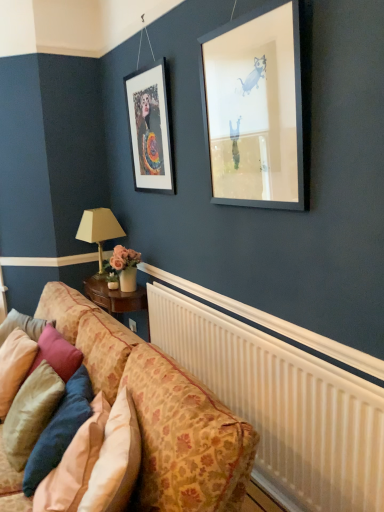
Image resolution: width=384 pixels, height=512 pixels. In order to click on white plastic radiator at lower right in this screenshot , I will do `click(282, 404)`.

This screenshot has width=384, height=512. Describe the element at coordinates (60, 430) in the screenshot. I see `velvety blue pillow at lower left, arranged as the third pillow when viewed from the left` at that location.

The width and height of the screenshot is (384, 512). I want to click on patterned fabric couch at lower left, so click(x=160, y=411).

This screenshot has width=384, height=512. What are the coordinates of `velvet pink pillow at lower left, the 2th pillow when ordered from left to right` in the screenshot? It's located at (31, 413).

Which is more to the right, velvet beige pillow at lower left, which is counted as the first pillow, starting from the left, or beige fabric lampshade at lower left?

beige fabric lampshade at lower left is more to the right.

Measure the distance between velvet beige pillow at lower left, which is counted as the first pillow, starting from the left, and beige fabric lampshade at lower left.

A distance of 1.24 meters exists between velvet beige pillow at lower left, which is counted as the first pillow, starting from the left, and beige fabric lampshade at lower left.

Is velvet beige pillow at lower left, the third pillow when ordered from right to left, shorter than beige fabric lampshade at lower left?

Incorrect, the height of velvet beige pillow at lower left, the third pillow when ordered from right to left, does not fall short of that of beige fabric lampshade at lower left.

Which object is further away from the camera, velvet beige pillow at lower left, the third pillow when ordered from right to left, or beige fabric lampshade at lower left?

beige fabric lampshade at lower left is more distant.

From the image's perspective, which is below, beige fabric lampshade at lower left or velvet pink pillow at lower left, the 2th pillow when ordered from left to right?

velvet pink pillow at lower left, the 2th pillow when ordered from left to right, is shown below in the image.

From a real-world perspective, who is located lower, beige fabric lampshade at lower left or velvet pink pillow at lower left, marked as the 2th pillow in a right-to-left arrangement?

velvet pink pillow at lower left, marked as the 2th pillow in a right-to-left arrangement, from a real-world perspective.

Could you tell me if beige fabric lampshade at lower left is turned towards velvet pink pillow at lower left, the 2th pillow when ordered from left to right?

No, beige fabric lampshade at lower left is not aimed at velvet pink pillow at lower left, the 2th pillow when ordered from left to right.

Can you confirm if beige fabric lampshade at lower left is bigger than velvet pink pillow at lower left, marked as the 2th pillow in a right-to-left arrangement?

Yes, beige fabric lampshade at lower left is bigger than velvet pink pillow at lower left, marked as the 2th pillow in a right-to-left arrangement.

Which is correct: matte black frame at upper left is inside velvet pink pillow at lower left, the 2th pillow when ordered from left to right, or outside of it?

matte black frame at upper left is spatially situated outside velvet pink pillow at lower left, the 2th pillow when ordered from left to right.

Is matte black frame at upper left placed right next to velvet pink pillow at lower left, the 2th pillow when ordered from left to right?

No, matte black frame at upper left is not touching velvet pink pillow at lower left, the 2th pillow when ordered from left to right.

From the image's perspective, is matte black frame at upper left above or below velvet pink pillow at lower left, marked as the 2th pillow in a right-to-left arrangement?

Clearly, from the image's perspective, matte black frame at upper left is above velvet pink pillow at lower left, marked as the 2th pillow in a right-to-left arrangement.

From the picture: How many degrees apart are the facing directions of matte black frame at upper left and velvet pink pillow at lower left, the 2th pillow when ordered from left to right?

They differ by 0.567 degrees in their facing directions.

From a real-world perspective, is velvety blue pillow at lower left, which ranks as the first pillow in right-to-left order, on top of white plastic radiator at lower right?

Indeed, from a real-world perspective, velvety blue pillow at lower left, which ranks as the first pillow in right-to-left order, stands above white plastic radiator at lower right.

From the image's perspective, would you say velvety blue pillow at lower left, arranged as the third pillow when viewed from the left, is shown under white plastic radiator at lower right?

Correct, velvety blue pillow at lower left, arranged as the third pillow when viewed from the left, appears lower than white plastic radiator at lower right in the image.

From the picture: Which is farther, (59, 448) or (218, 366)?

The point (218, 366) is more distant.

I want to click on the 1st pillow counting from the left of the white plastic radiator at lower right, so click(x=60, y=430).

Which object is wider, velvet beige pillow at lower left, which is counted as the first pillow, starting from the left, or patterned fabric couch at lower left?

patterned fabric couch at lower left.

Is velvet beige pillow at lower left, the third pillow when ordered from right to left, in contact with patterned fabric couch at lower left?

velvet beige pillow at lower left, the third pillow when ordered from right to left, and patterned fabric couch at lower left are not in contact.

From the image's perspective, between velvet beige pillow at lower left, which is counted as the first pillow, starting from the left, and patterned fabric couch at lower left, which one is located above?

velvet beige pillow at lower left, which is counted as the first pillow, starting from the left, appears higher in the image.

Is patterned fabric couch at lower left in contact with matte black frame at upper left?

They are not placed beside each other.

Is patterned fabric couch at lower left shorter than matte black frame at upper left?

Yes.

Which is more to the left, patterned fabric couch at lower left or matte black frame at upper left?

Positioned to the left is patterned fabric couch at lower left.

How many degrees apart are the facing directions of patterned fabric couch at lower left and matte black frame at upper left?

The facing directions of patterned fabric couch at lower left and matte black frame at upper left are 0.567 degrees apart.

Between velvet beige pillow at lower left, which is counted as the first pillow, starting from the left, and velvety blue pillow at lower left, which ranks as the first pillow in right-to-left order, which one appears on the right side from the viewer's perspective?

From the viewer's perspective, velvety blue pillow at lower left, which ranks as the first pillow in right-to-left order, appears more on the right side.

Does velvet beige pillow at lower left, which is counted as the first pillow, starting from the left, lie in front of velvety blue pillow at lower left, which ranks as the first pillow in right-to-left order?

No, velvet beige pillow at lower left, which is counted as the first pillow, starting from the left, is further to the viewer.

From the image's perspective, is velvet beige pillow at lower left, which is counted as the first pillow, starting from the left, below velvety blue pillow at lower left, which ranks as the first pillow in right-to-left order?

Actually, velvet beige pillow at lower left, which is counted as the first pillow, starting from the left, appears above velvety blue pillow at lower left, which ranks as the first pillow in right-to-left order, in the image.

Is velvet beige pillow at lower left, which is counted as the first pillow, starting from the left, outside of velvety blue pillow at lower left, which ranks as the first pillow in right-to-left order?

Indeed, velvet beige pillow at lower left, which is counted as the first pillow, starting from the left, is completely outside velvety blue pillow at lower left, which ranks as the first pillow in right-to-left order.

Locate an element on the screen. The height and width of the screenshot is (512, 384). table lamp that is behind the velvet beige pillow at lower left, which is counted as the first pillow, starting from the left is located at coordinates (99, 229).

Starting from the beige fabric lampshade at lower left, which pillow is the 2nd one in front? Please provide its 2D coordinates.

[(31, 413)]

Considering their positions, is velvet beige pillow at lower left, the third pillow when ordered from right to left, positioned closer to velvet pink pillow at lower left, the 2th pillow when ordered from left to right, than white plastic radiator at lower right?

velvet beige pillow at lower left, the third pillow when ordered from right to left.

Considering their positions, is white plastic radiator at lower right positioned further to matte black frame at upper left than patterned fabric couch at lower left?

white plastic radiator at lower right is further to matte black frame at upper left.

Considering their positions, is velvet pink pillow at lower left, marked as the 2th pillow in a right-to-left arrangement, positioned further to matte black frame at upper left than patterned fabric couch at lower left?

velvet pink pillow at lower left, marked as the 2th pillow in a right-to-left arrangement.

When comparing their distances from velvety blue pillow at lower left, which ranks as the first pillow in right-to-left order, does patterned fabric couch at lower left or velvet pink pillow at lower left, the 2th pillow when ordered from left to right, seem further?

patterned fabric couch at lower left lies further to velvety blue pillow at lower left, which ranks as the first pillow in right-to-left order, than the other object.

Looking at the image, which one is located further to velvety blue pillow at lower left, arranged as the third pillow when viewed from the left, matte black frame at upper left or beige fabric lampshade at lower left?

The object further to velvety blue pillow at lower left, arranged as the third pillow when viewed from the left, is beige fabric lampshade at lower left.

Estimate the real-world distances between objects in this image. Which object is further from velvety blue pillow at lower left, which ranks as the first pillow in right-to-left order, beige fabric lampshade at lower left or velvet pink pillow at lower left, marked as the 2th pillow in a right-to-left arrangement?

Among the two, beige fabric lampshade at lower left is located further to velvety blue pillow at lower left, which ranks as the first pillow in right-to-left order.

When comparing their distances from patterned fabric couch at lower left, does white plastic radiator at lower right or beige fabric lampshade at lower left seem closer?

white plastic radiator at lower right is positioned closer to the anchor patterned fabric couch at lower left.

When comparing their distances from velvet pink pillow at lower left, marked as the 2th pillow in a right-to-left arrangement, does velvet beige pillow at lower left, which is counted as the first pillow, starting from the left, or matte black frame at upper left seem closer?

Based on the image, velvet beige pillow at lower left, which is counted as the first pillow, starting from the left, appears to be nearer to velvet pink pillow at lower left, marked as the 2th pillow in a right-to-left arrangement.

You are a GUI agent. You are given a task and a screenshot of the screen. Output one action in this format:
    pyautogui.click(x=<x>, y=<y>)
    Task: Click on the pillow between velvety blue pillow at lower left, arranged as the third pillow when viewed from the left, and velvet beige pillow at lower left, the third pillow when ordered from right to left, along the z-axis
    The width and height of the screenshot is (384, 512).
    Given the screenshot: What is the action you would take?
    pyautogui.click(x=31, y=413)

Locate an element on the screen. pillow located between patterned fabric couch at lower left and velvet pink pillow at lower left, marked as the 2th pillow in a right-to-left arrangement, in the depth direction is located at coordinates (60, 430).

At what (x,y) coordinates should I click in order to perform the action: click on radiator that lies between matte black frame at upper left and patterned fabric couch at lower left from top to bottom. Please return your answer as a coordinate pair (x, y). Image resolution: width=384 pixels, height=512 pixels. Looking at the image, I should click on point(282,404).

Image resolution: width=384 pixels, height=512 pixels. In order to click on radiator between velvety blue pillow at lower left, which ranks as the first pillow in right-to-left order, and beige fabric lampshade at lower left in the front-back direction in this screenshot , I will do `click(282, 404)`.